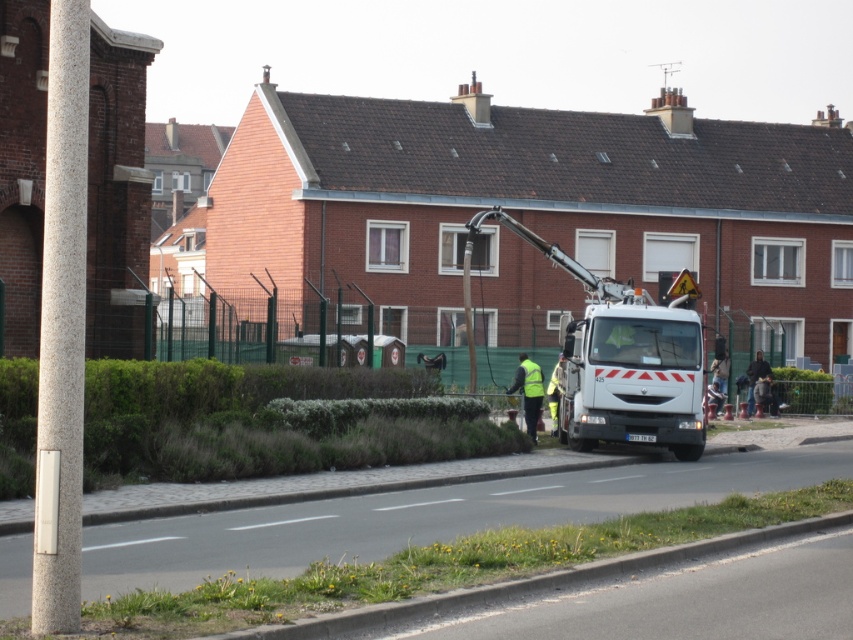
Does white glossy truck at center appear on the left side of high visibility yellow vest at center?

Incorrect, white glossy truck at center is not on the left side of high visibility yellow vest at center.

Measure the distance between point (587, 364) and camera.

Point (587, 364) and camera are 30.06 meters apart.

Which is behind, point (469, 333) or point (531, 436)?

Point (469, 333)

The height and width of the screenshot is (640, 853). Find the location of `white glossy truck at center`. white glossy truck at center is located at coordinates (624, 356).

Does point (650, 396) lie in front of point (535, 378)?

That is True.

Which is behind, point (579, 269) or point (532, 372)?

Point (532, 372)

The height and width of the screenshot is (640, 853). What do you see at coordinates (624, 356) in the screenshot? I see `white glossy truck at center` at bounding box center [624, 356].

In order to click on white glossy truck at center in this screenshot , I will do `click(624, 356)`.

The width and height of the screenshot is (853, 640). What do you see at coordinates (527, 392) in the screenshot?
I see `high visibility yellow vest at center` at bounding box center [527, 392].

Is high visibility yellow vest at center to the left of yellow reflective safety vest at center from the viewer's perspective?

Correct, you'll find high visibility yellow vest at center to the left of yellow reflective safety vest at center.

This screenshot has height=640, width=853. What are the coordinates of `high visibility yellow vest at center` in the screenshot? It's located at (527, 392).

Locate an element on the screen. Image resolution: width=853 pixels, height=640 pixels. high visibility yellow vest at center is located at coordinates (527, 392).